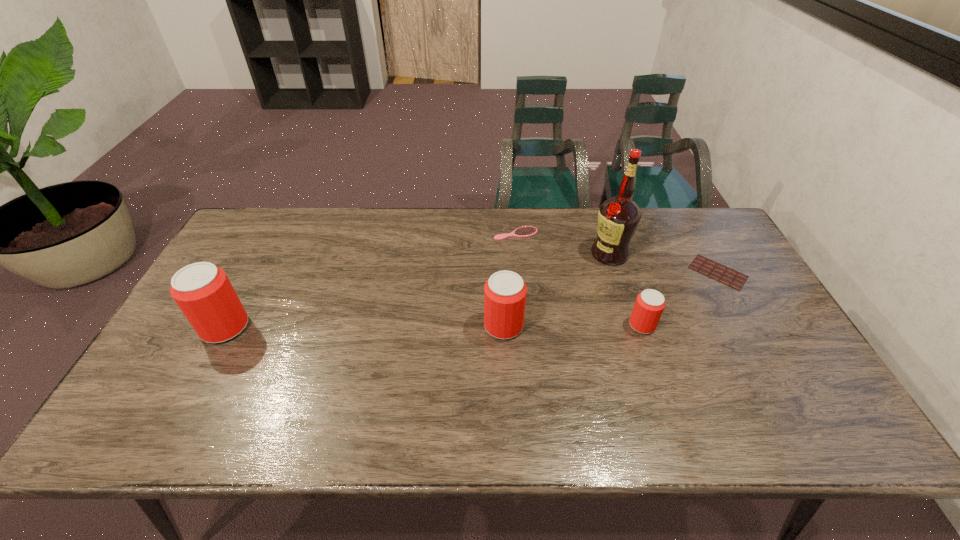
This screenshot has height=540, width=960. I want to click on vacant area situated on the back of the leftmost beer can, so click(263, 256).

The image size is (960, 540). What are the coordinates of `vacant area situated 0.070m on the front of the second tallest beer can` in the screenshot? It's located at (505, 364).

The width and height of the screenshot is (960, 540). Identify the location of vacant space located on the left of the shortest beer can. (574, 325).

Find the location of `free space located 0.110m on the front of the shortest object`. free space located 0.110m on the front of the shortest object is located at coordinates (745, 320).

At what (x,y) coordinates should I click in order to perform the action: click on vacant space located 0.110m on the back of the farthest object. Please return your answer as a coordinate pair (x, y). This screenshot has height=540, width=960. Looking at the image, I should click on (514, 209).

The image size is (960, 540). Identify the location of free point located on the label of the tallest object. (472, 254).

At what (x,y) coordinates should I click in order to perform the action: click on vacant space located on the label of the tallest object. Please return your answer as a coordinate pair (x, y). The image size is (960, 540). Looking at the image, I should click on (563, 254).

The image size is (960, 540). Find the location of `vacant area located on the label of the tallest object`. vacant area located on the label of the tallest object is located at coordinates (535, 254).

Identify the location of hairbrush positioned at the far edge. (526, 231).

Image resolution: width=960 pixels, height=540 pixels. I want to click on alcohol positioned at the far edge, so click(618, 218).